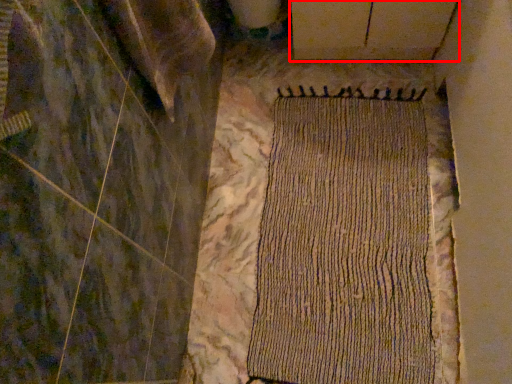
Question: From the image's perspective, where is plywood (annotated by the red box) located in relation to mat in the image?

Choices:
 (A) below
 (B) above

Answer: (B)